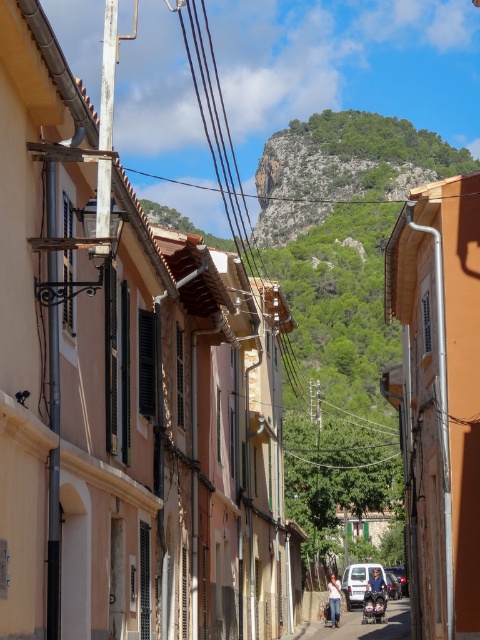
You are a delivery person who needs to park your metallic silver motorcycle at center and metallic silver car at center on the same street. Given the narrow street, can both vehicles be parked side by side without overlapping?

The distance between the metallic silver motorcycle at center and metallic silver car at center is 26.47 meters. Since the street is narrow, but the distance between them allows for side parking, both vehicles can be parked side by side without overlapping.